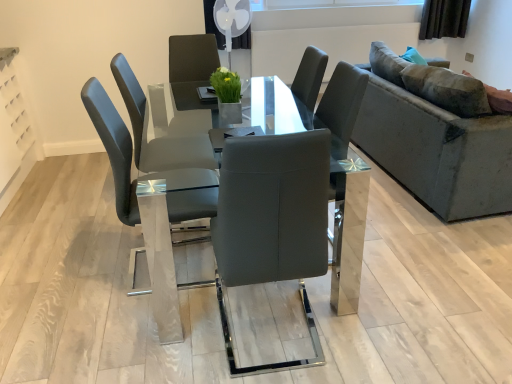
Question: Is transparent glass table at center taller or shorter than matte gray chair at center?

Choices:
 (A) tall
 (B) short

Answer: (B)

Question: From the image's perspective, is transparent glass table at center positioned above or below matte gray chair at center?

Choices:
 (A) below
 (B) above

Answer: (A)

Question: Which object is the farthest from the matte gray chair at center?

Choices:
 (A) velvet grey couch at right
 (B) transparent glass table at center

Answer: (A)

Question: Which is nearer to the matte gray chair at center?

Choices:
 (A) transparent glass table at center
 (B) velvet grey couch at right

Answer: (A)